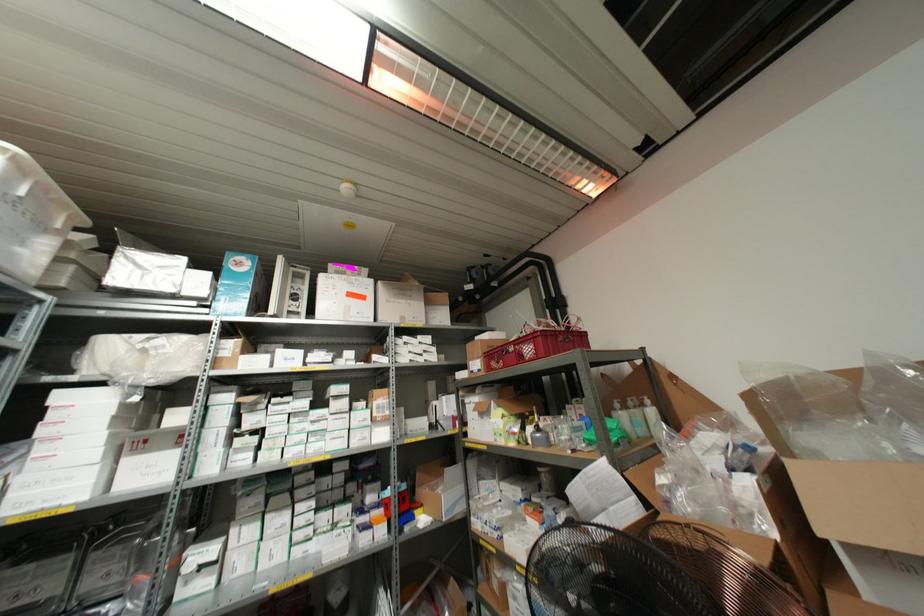
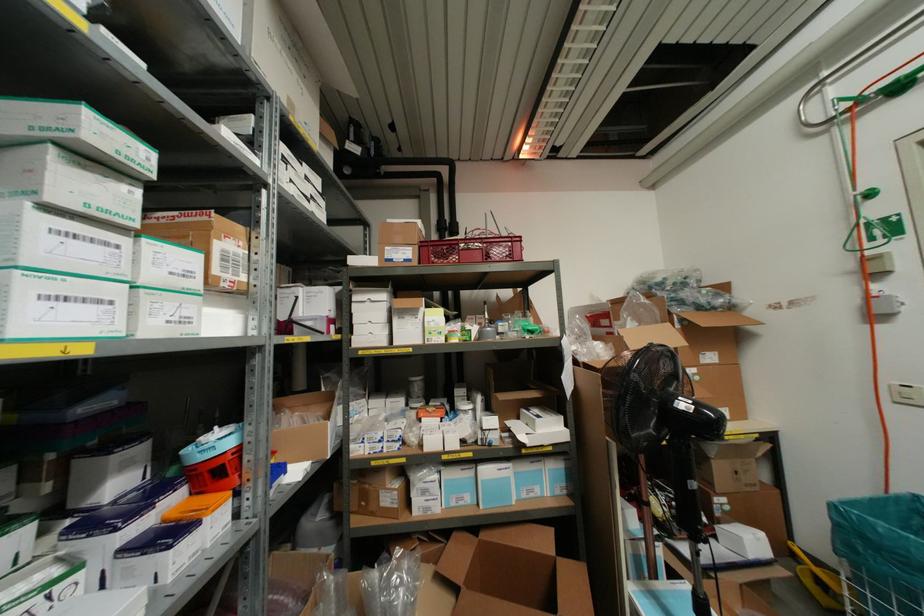
The point at (x=466, y=400) is marked in the first image. Where is the corresponding point in the second image?

(354, 298)